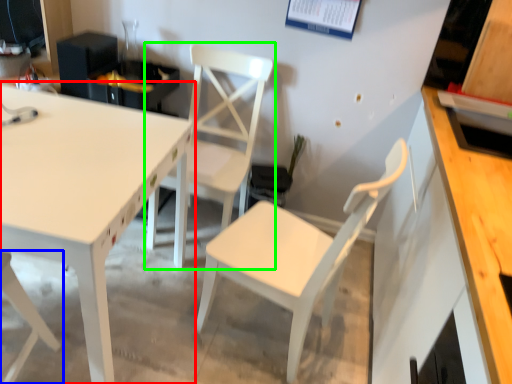
Question: Which is farther away from table (highlighted by a red box)? chair (highlighted by a blue box) or chair (highlighted by a green box)?

Choices:
 (A) chair
 (B) chair

Answer: (B)